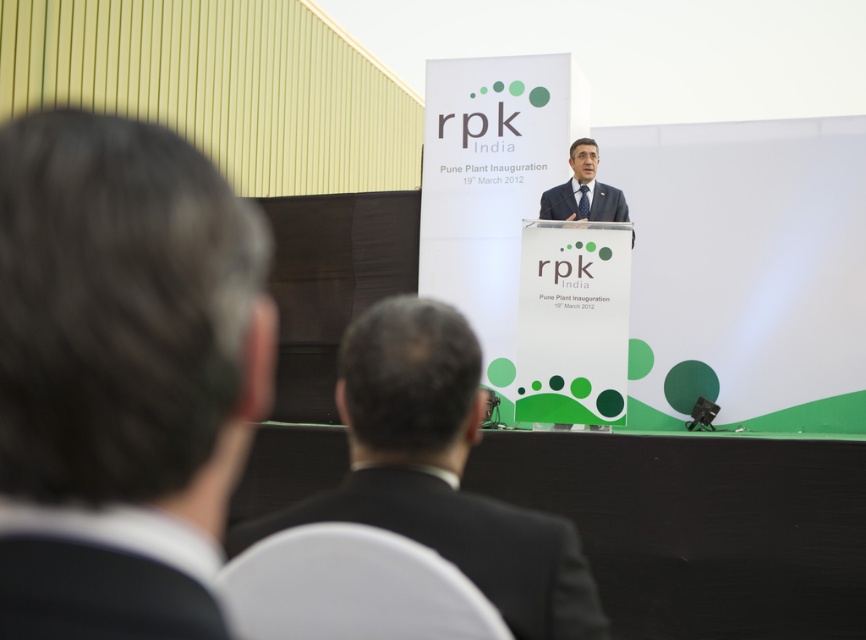
Question: Which point appears closest to the camera in this image?

Choices:
 (A) (441, 545)
 (B) (76, 330)
 (C) (595, 200)
 (D) (68, 586)

Answer: (D)

Question: Which of the following is the closest to the observer?

Choices:
 (A) (580, 177)
 (B) (192, 534)

Answer: (B)

Question: Is black suit at center behind black matte suit at lower left?

Choices:
 (A) no
 (B) yes

Answer: (B)

Question: Is dark brown hair at left bigger than black suit at center?

Choices:
 (A) yes
 (B) no

Answer: (B)

Question: Is black suit at center to the left of dark gray suit at center from the viewer's perspective?

Choices:
 (A) no
 (B) yes

Answer: (B)

Question: Which is farther from the dark gray suit at center?

Choices:
 (A) black suit at center
 (B) black matte suit at lower left

Answer: (B)